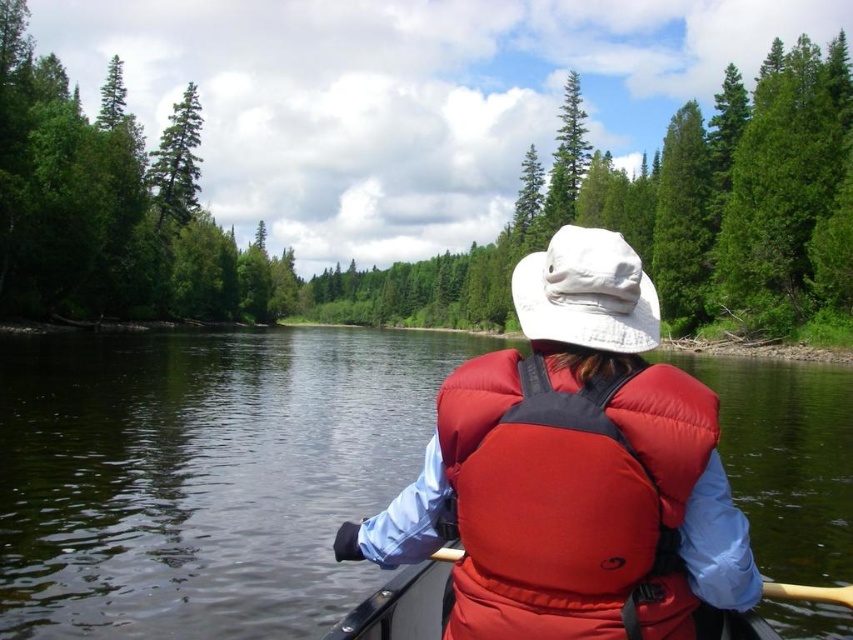
Question: Can you confirm if matte red life vest at center is bigger than rubberized red canoe at center?

Choices:
 (A) yes
 (B) no

Answer: (A)

Question: Is rubberized red canoe at center to the right of green matte tree at upper left from the viewer's perspective?

Choices:
 (A) yes
 (B) no

Answer: (A)

Question: Which object is closer to the camera taking this photo?

Choices:
 (A) green matte tree at center
 (B) matte red life vest at center
 (C) wooden paddle at center
 (D) dark green water at center

Answer: (C)

Question: Which is farther from the green matte tree at center?

Choices:
 (A) wooden paddle at center
 (B) green matte tree at upper left

Answer: (A)

Question: Estimate the real-world distances between objects in this image. Which object is closer to the green textured pine tree at upper center?

Choices:
 (A) green matte tree at upper left
 (B) matte red life vest at center
 (C) green matte tree at center
 (D) red matte life jacket at center

Answer: (A)

Question: Is red matte life jacket at center bigger than wooden paddle at center?

Choices:
 (A) no
 (B) yes

Answer: (A)